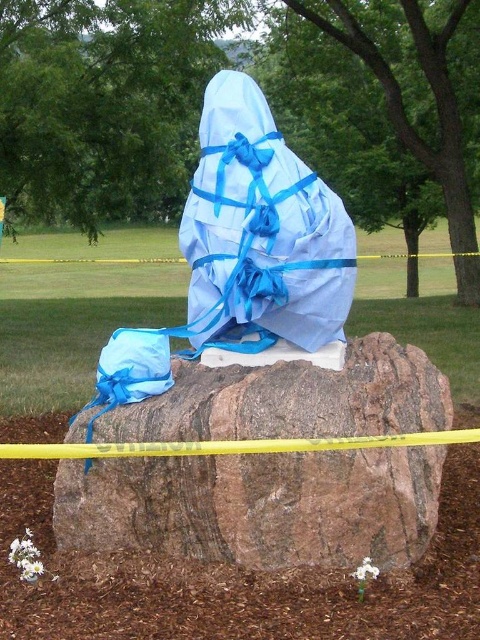
Is brown rough rock at center positioned behind blue fabric bag at center?

That is False.

Which is below, brown rough rock at center or blue fabric bag at center?

brown rough rock at center

The width and height of the screenshot is (480, 640). In order to click on brown rough rock at center in this screenshot , I will do `click(255, 506)`.